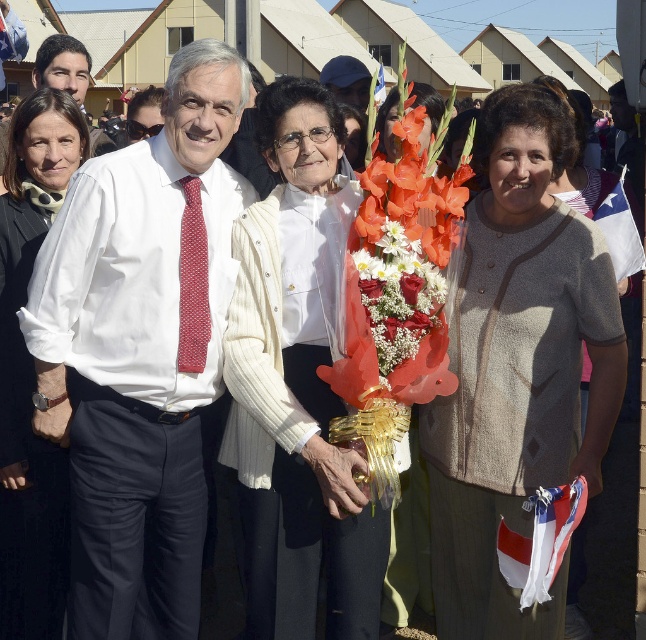
Question: Which of the following is the closest to the observer?

Choices:
 (A) white fabric flag at right
 (B) white fabric flag at lower right

Answer: (B)

Question: Is white shirt at center closer to camera compared to red fabric flag at center?

Choices:
 (A) yes
 (B) no

Answer: (B)

Question: Which object is the closest to the matte orange bouquet at center?

Choices:
 (A) red fabric flag at center
 (B) white fabric flag at lower right

Answer: (A)

Question: Is white fabric flag at right bigger than red fabric flag at center?

Choices:
 (A) no
 (B) yes

Answer: (A)

Question: Does beige knitted sweater at center appear over white fabric flag at lower right?

Choices:
 (A) yes
 (B) no

Answer: (A)

Question: Which of the following is the farthest from the observer?

Choices:
 (A) (377, 74)
 (B) (630, 221)
 (C) (397, 179)
 (D) (249, 228)

Answer: (A)